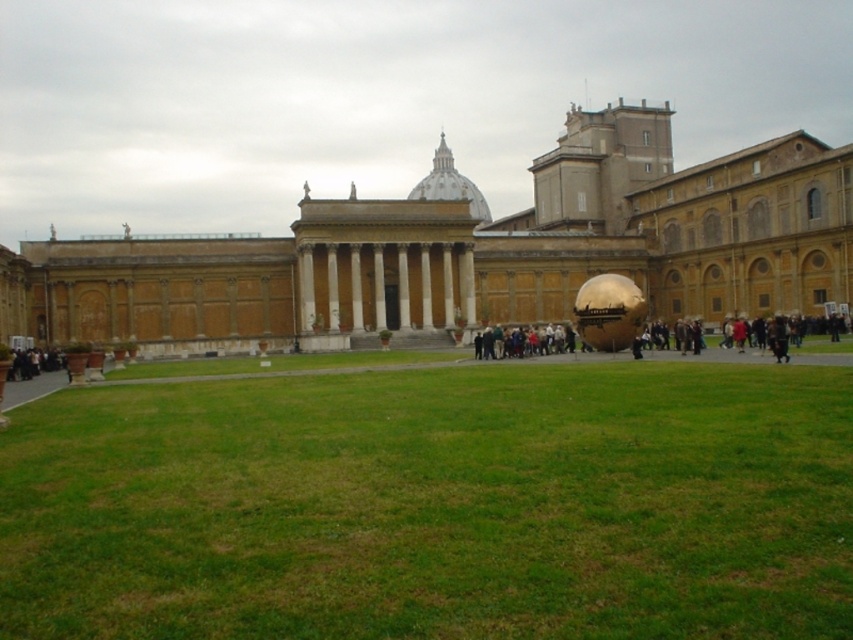
You are a gardener trying to water the green grass at center. However, there is a golden polished sphere at center in the way. Can you water the grass directly under the sphere without moving it?

The green grass at center is positioned under the golden polished sphere at center, so you can water the grass directly under the sphere without moving it since the grass is located beneath the sphere.

You are standing at the edge of the grassy area in front of the grand building. You want to walk to the golden sphere sculpture located in the center of the courtyard. There is a patch of green grass at center marked by point (434,506). Is the golden sphere sculpture located closer to the edge of the grassy area or closer to the center of the grassy area?

The golden sphere sculpture is located in the center of the courtyard, so it is closer to the center of the grassy area marked by point (434,506) rather than the edge.